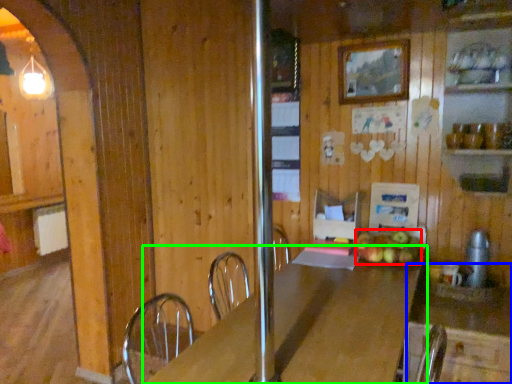
Question: Estimate the real-world distances between objects in this image. Which object is farther from apple (highlighted by a red box), counter (highlighted by a blue box) or table (highlighted by a green box)?

Choices:
 (A) counter
 (B) table

Answer: (B)